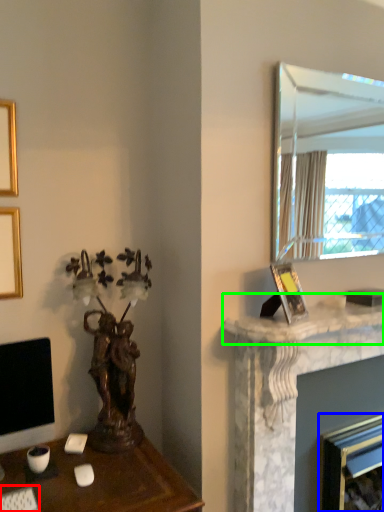
Question: Estimate the real-world distances between objects in this image. Which object is closer to computer keyboard (highlighted by a red box), fireplace (highlighted by a blue box) or counter top (highlighted by a green box)?

Choices:
 (A) fireplace
 (B) counter top

Answer: (B)